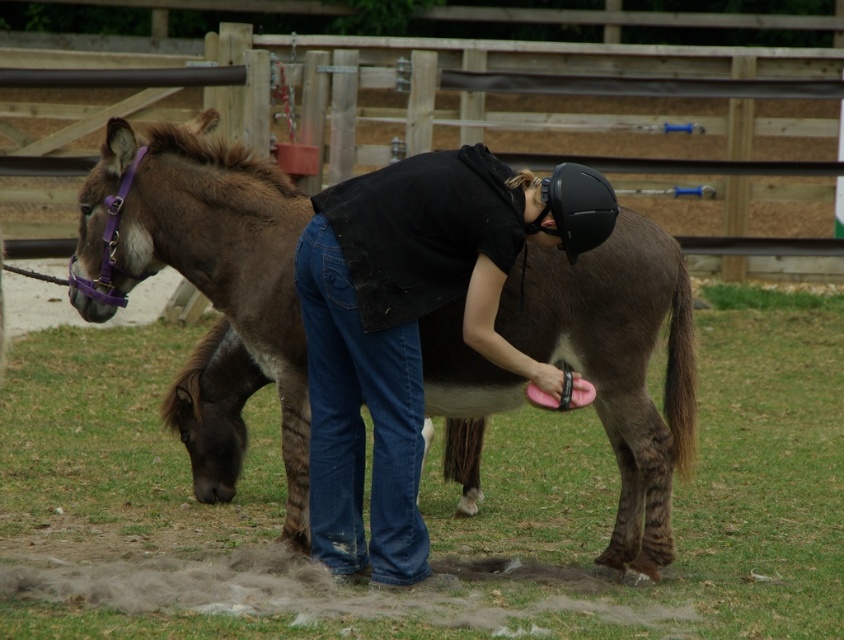
Question: Does black matte helmet at upper center have a lesser width compared to black matte helmet at center?

Choices:
 (A) no
 (B) yes

Answer: (A)

Question: Is brown matte mule at center to the left of black matte helmet at upper center from the viewer's perspective?

Choices:
 (A) no
 (B) yes

Answer: (A)

Question: Which of the following is the farthest from the observer?

Choices:
 (A) brown matte mule at center
 (B) black matte helmet at center

Answer: (A)

Question: Among these points, which one is nearest to the camera?

Choices:
 (A) (610, 209)
 (B) (247, 272)

Answer: (A)

Question: Which object is farther from the camera taking this photo?

Choices:
 (A) black matte helmet at center
 (B) black matte helmet at upper center
 (C) brown matte mule at center

Answer: (C)

Question: Does brown matte mule at center have a lesser width compared to black matte helmet at upper center?

Choices:
 (A) no
 (B) yes

Answer: (B)